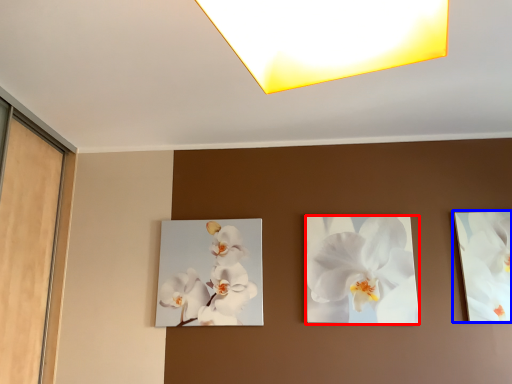
Question: Which point is closer to the camera, flower (highlighted by a red box) or picture frame (highlighted by a blue box)?

Choices:
 (A) flower
 (B) picture frame

Answer: (B)